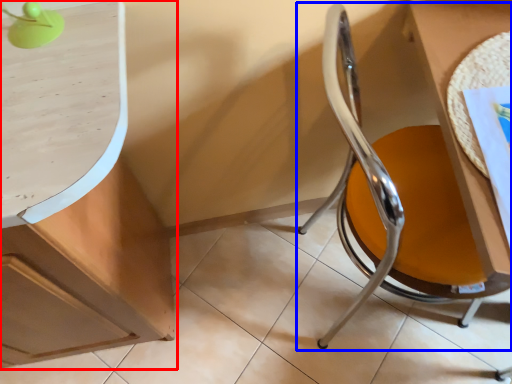
Question: Among these objects, which one is nearest to the camera, cabinetry (highlighted by a red box) or chair (highlighted by a blue box)?

Choices:
 (A) cabinetry
 (B) chair

Answer: (B)